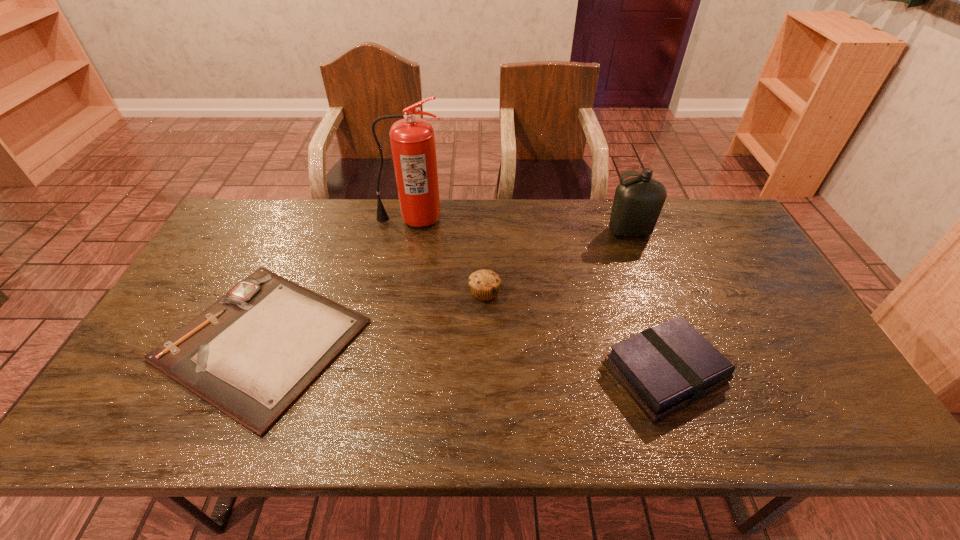
I want to click on fire extinguisher positioned at the far edge, so click(x=412, y=139).

The image size is (960, 540). Identify the location of bottle positioned at the far edge. (638, 201).

Where is `book positioned at the near edge`? This screenshot has height=540, width=960. book positioned at the near edge is located at coordinates (664, 368).

Where is `clipboard that is at the near edge`? clipboard that is at the near edge is located at coordinates (252, 353).

Where is `object located at the left edge`? object located at the left edge is located at coordinates (252, 353).

I want to click on object that is at the near left corner, so click(x=252, y=353).

The height and width of the screenshot is (540, 960). Find the location of `vacant space at the far edge`. vacant space at the far edge is located at coordinates (367, 211).

In order to click on free region at the left edge of the desktop in this screenshot , I will do `click(243, 263)`.

Image resolution: width=960 pixels, height=540 pixels. Find the location of `free location at the right edge of the desktop`. free location at the right edge of the desktop is located at coordinates (722, 277).

I want to click on free space at the far right corner, so click(x=731, y=225).